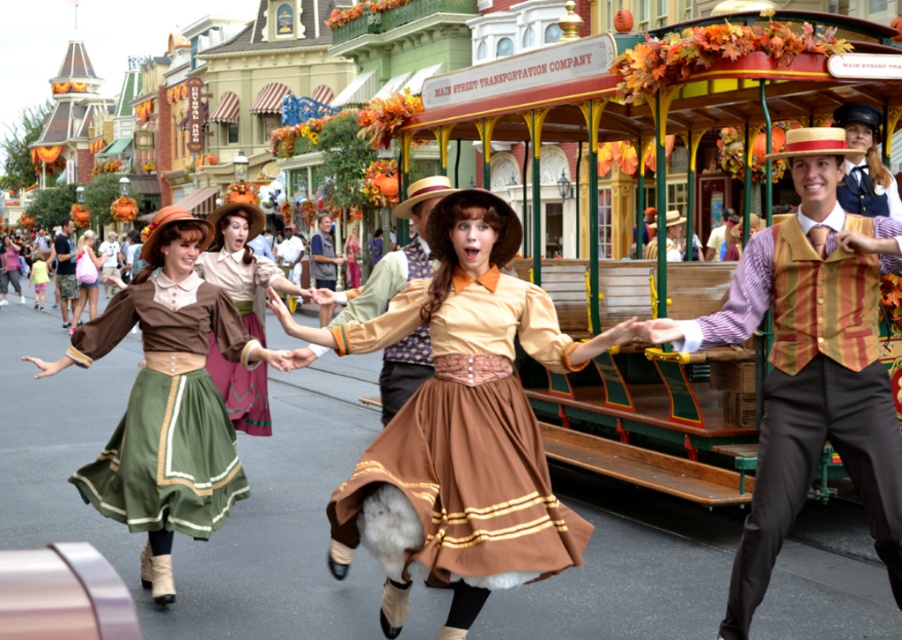
Looking at this image, you are a photographer standing at the front of the scene. You want to take a photo that includes both the point at point (x=774, y=385) and point (x=127, y=433). Which point should you focus on to ensure the closer one is sharp?

You should focus on point (x=774, y=385) because it is closer to the camera than point (x=127, y=433), ensuring it will be in focus.

You are a photographer positioned at the center of the scene. You want to capture a closeup shot of the matte brown vest at center. Which direction should you move to get closer to it?

The matte brown vest at center is already at the center of the scene, so you don not need to move to capture it. You can adjust your zoom instead.

You are standing at the entrance of the theme park and want to find the striped vest at center. According to the coordinates provided, where should you look to locate it?

The striped vest at center is located at coordinates point (810, 365).